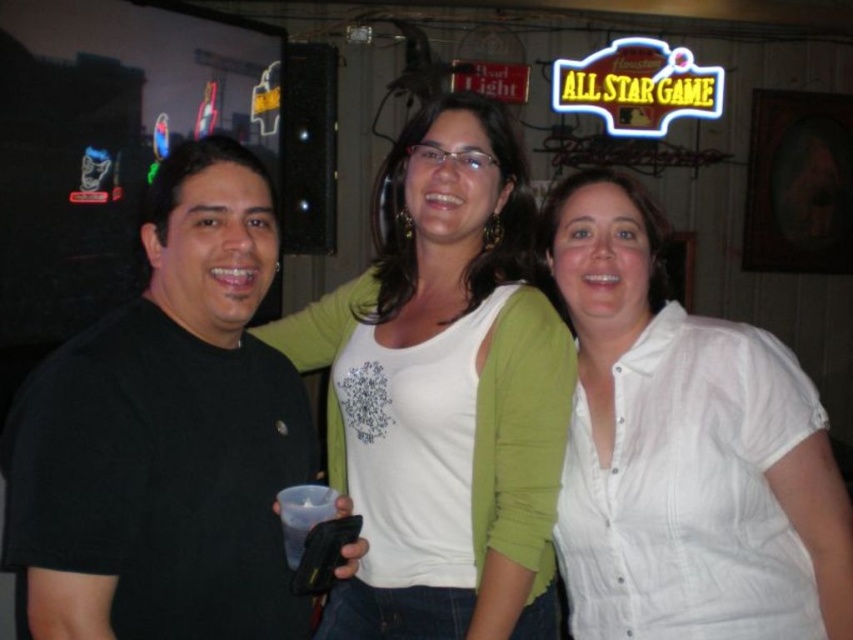
Is black matte shirt at left bigger than white matte shirt at center?

No, black matte shirt at left is not bigger than white matte shirt at center.

Can you confirm if black matte shirt at left is positioned to the right of white matte shirt at center?

In fact, black matte shirt at left is to the left of white matte shirt at center.

I want to click on black matte shirt at left, so click(x=165, y=435).

You are a GUI agent. You are given a task and a screenshot of the screen. Output one action in this format:
    pyautogui.click(x=<x>, y=<y>)
    Task: Click on the black matte shirt at left
    Image resolution: width=853 pixels, height=640 pixels.
    Given the screenshot: What is the action you would take?
    pyautogui.click(x=165, y=435)

Can you confirm if white cotton shirt at center is smaller than white matte shirt at center?

Correct, white cotton shirt at center occupies less space than white matte shirt at center.

Based on the photo, is white cotton shirt at center bigger than white matte shirt at center?

No.

You are a GUI agent. You are given a task and a screenshot of the screen. Output one action in this format:
    pyautogui.click(x=<x>, y=<y>)
    Task: Click on the white cotton shirt at center
    
    Given the screenshot: What is the action you would take?
    pyautogui.click(x=683, y=449)

Between black matte shirt at left and white cotton shirt at center, which one has less height?

With less height is black matte shirt at left.

Does black matte shirt at left come behind white cotton shirt at center?

No, it is not.

Is point (45, 458) behind point (627, 186)?

No, (45, 458) is closer to viewer.

Find the location of a particular element. This screenshot has width=853, height=640. black matte shirt at left is located at coordinates (165, 435).